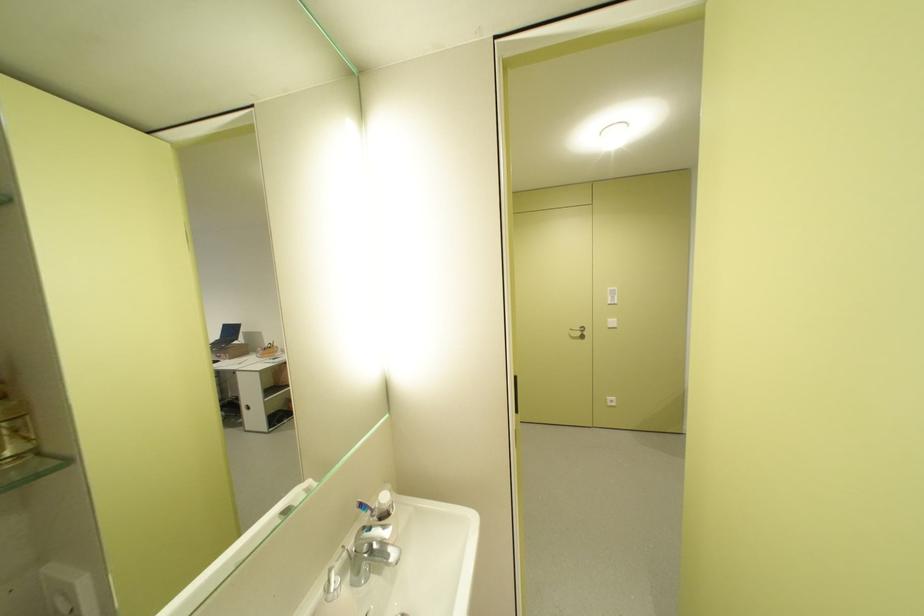
Where would you turn the silver door handle? Please return your answer as a coordinate pair (x, y).

(578, 331)